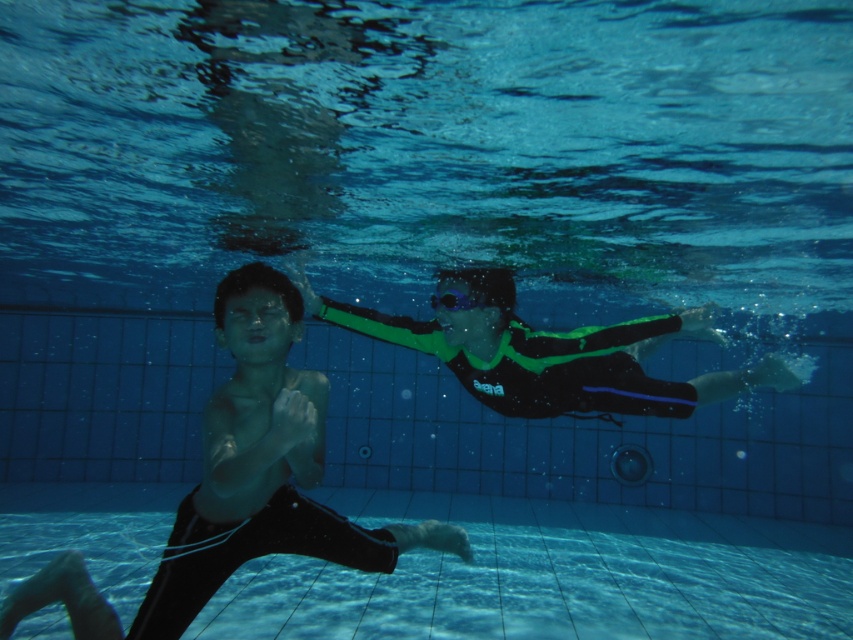
You are a lifeguard trying to determine which swimmer is closer to the edge of the pool. You see two swimmers wearing the black matte wetsuit at center and the green matte wetsuit at center. Which one has a narrower width and might be easier to grab?

The black matte wetsuit at center has a narrower width than the green matte wetsuit at center, so it might be easier to grab.

You are a lifeguard on duty and need to retrieve an object from the pool. You see a transparent plastic swimmer at lower center and a transparent plastic goggles at center. Which object is farther away from you?

The transparent plastic swimmer at lower center is farther away from you since it is 2.83 meters away from the transparent plastic goggles at center, which is closer to your position as a lifeguard.

You are a lifeguard observing the underwater scene. You notice two items floating in the water. Which item is shorter between the transparent plastic swimmer at lower center and the transparent plastic goggles at center?

The transparent plastic swimmer at lower center is not as tall as the transparent plastic goggles at center, so the transparent plastic swimmer at lower center is shorter.